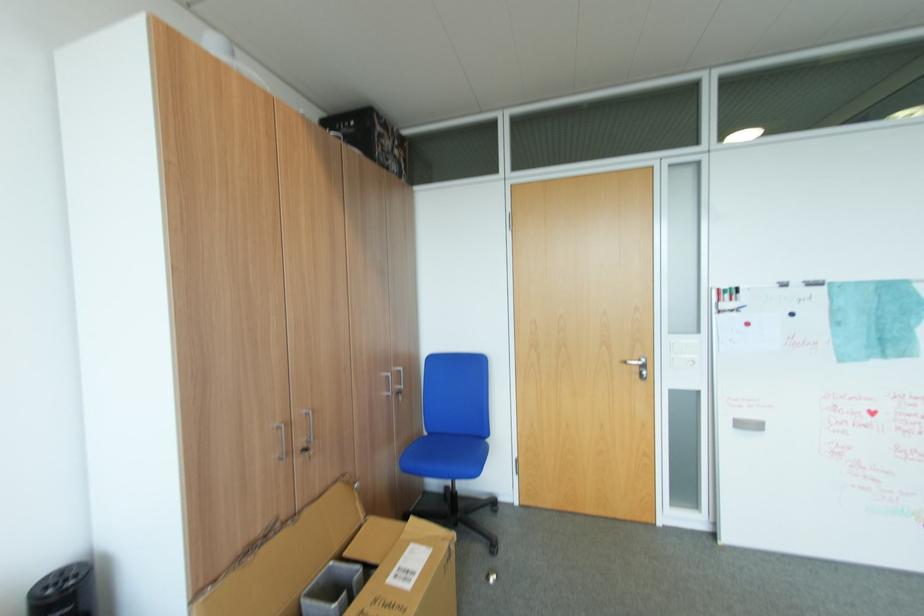
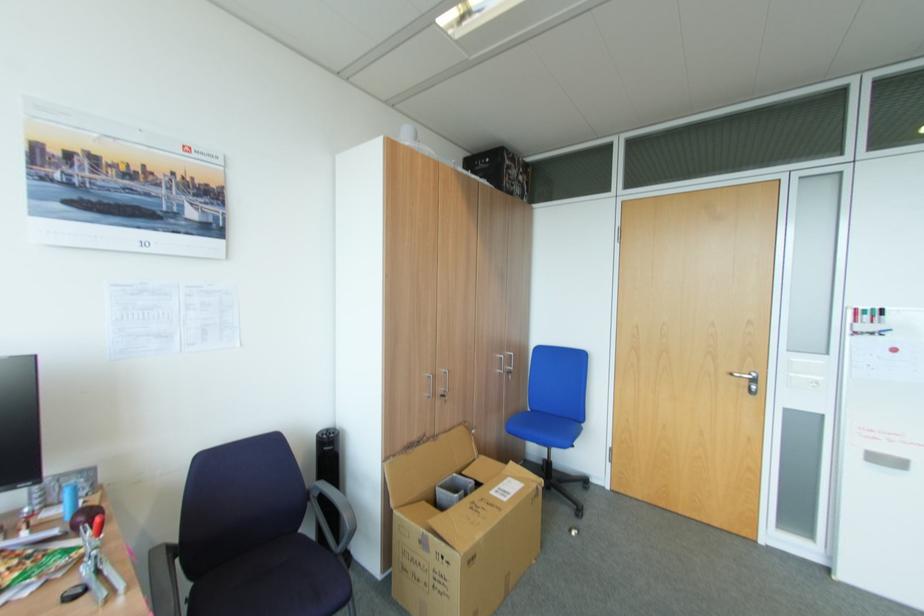
The point at [409,469] is marked in the first image. Where is the corresponding point in the second image?

(515, 431)